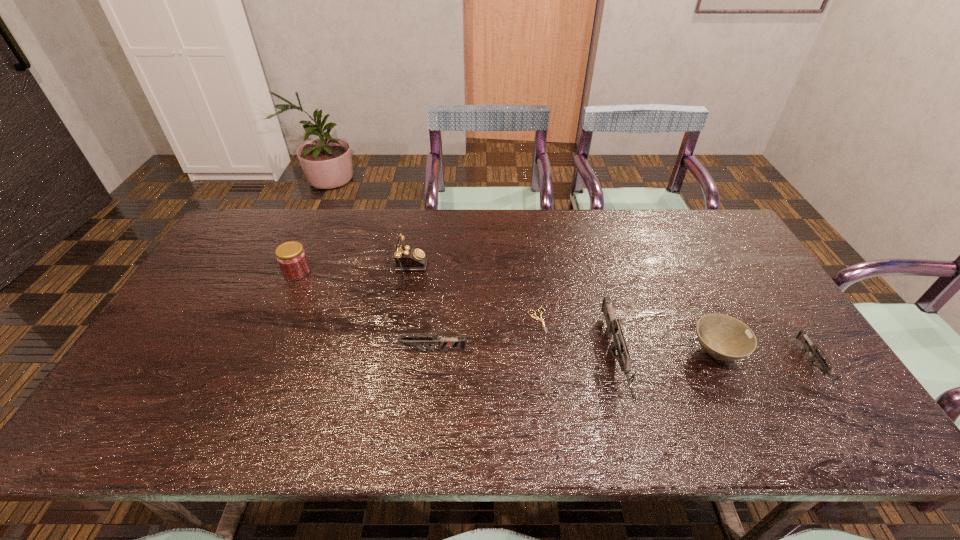
Image resolution: width=960 pixels, height=540 pixels. Identify the location of free spot that satisfies the following two spatial constraints: 1. on the dial of the second object from right to left; 2. on the left side of the telephone. (382, 353).

Identify the location of vacant area in the image that satisfies the following two spatial constraints: 1. on the dial of the telephone; 2. on the right side of the shortest object. This screenshot has height=540, width=960. (388, 321).

Find the location of a particular element. This screenshot has height=540, width=960. free space that satisfies the following two spatial constraints: 1. on the front side of the bowl; 2. on the right side of the fourth object from left to right is located at coordinates (541, 353).

Where is `free space that satisfies the following two spatial constraints: 1. on the front side of the leftmost object; 2. on the right side of the bowl`? The width and height of the screenshot is (960, 540). free space that satisfies the following two spatial constraints: 1. on the front side of the leftmost object; 2. on the right side of the bowl is located at coordinates (261, 353).